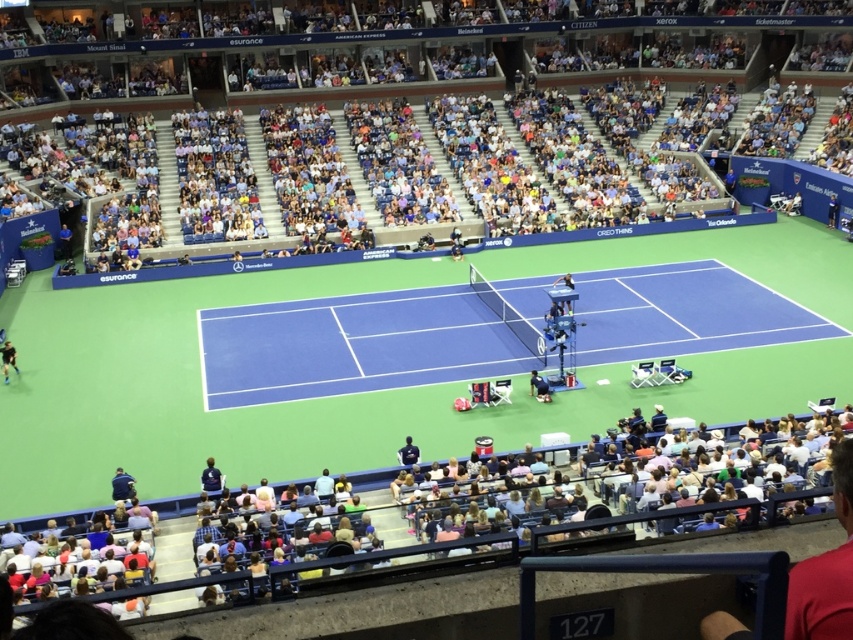
Question: Is blue synthetic turf tennis court at center bigger than black fabric person at lower left?

Choices:
 (A) no
 (B) yes

Answer: (B)

Question: Which object appears farthest from the camera in this image?

Choices:
 (A) black fabric person at lower left
 (B) blue fabric seats at upper center
 (C) blue synthetic turf tennis court at center
 (D) dark blue fabric chair at center

Answer: (B)

Question: Which point is farther from the camera taking this photo?

Choices:
 (A) (820, 19)
 (B) (547, 387)

Answer: (A)

Question: Is blue fabric seats at upper center below black fabric person at lower left?

Choices:
 (A) yes
 (B) no

Answer: (B)

Question: Can you confirm if blue synthetic turf tennis court at center is thinner than dark blue fabric chair at center?

Choices:
 (A) yes
 (B) no

Answer: (B)

Question: Estimate the real-world distances between objects in this image. Which object is farther from the black fabric person at lower left?

Choices:
 (A) blue synthetic turf tennis court at center
 (B) blue fabric seats at upper center

Answer: (B)